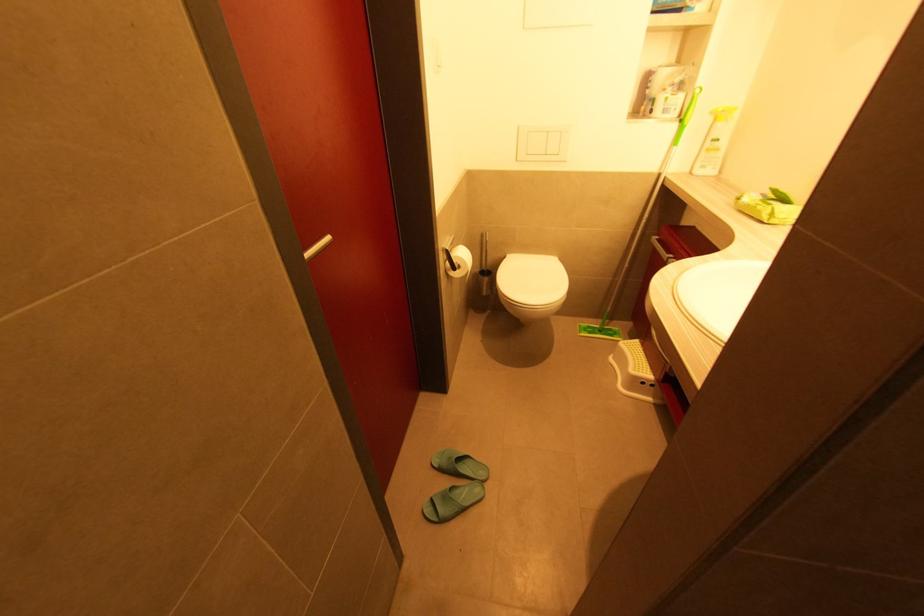
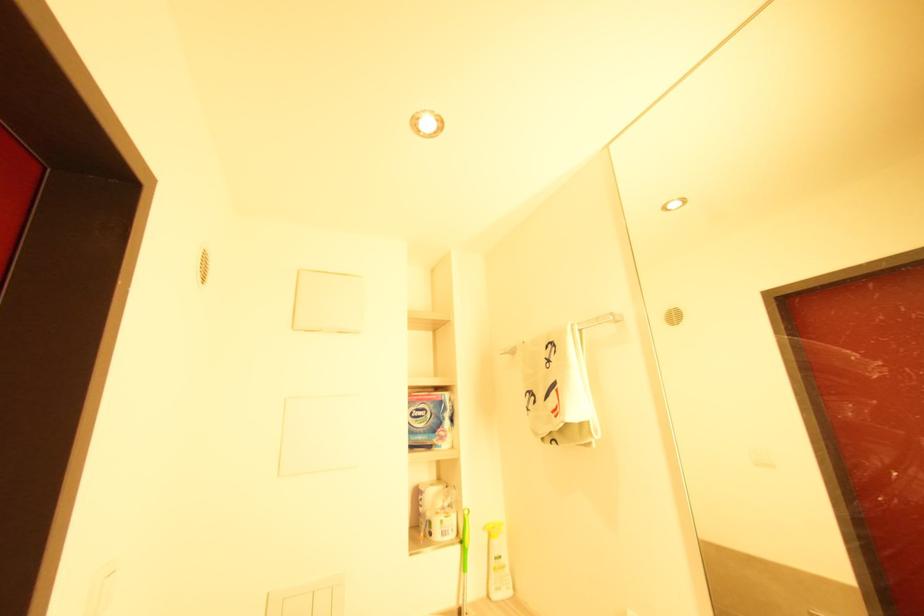
The images are taken continuously from a first-person perspective. In which direction is your viewpoint rotating?

The camera rotated toward right-up.